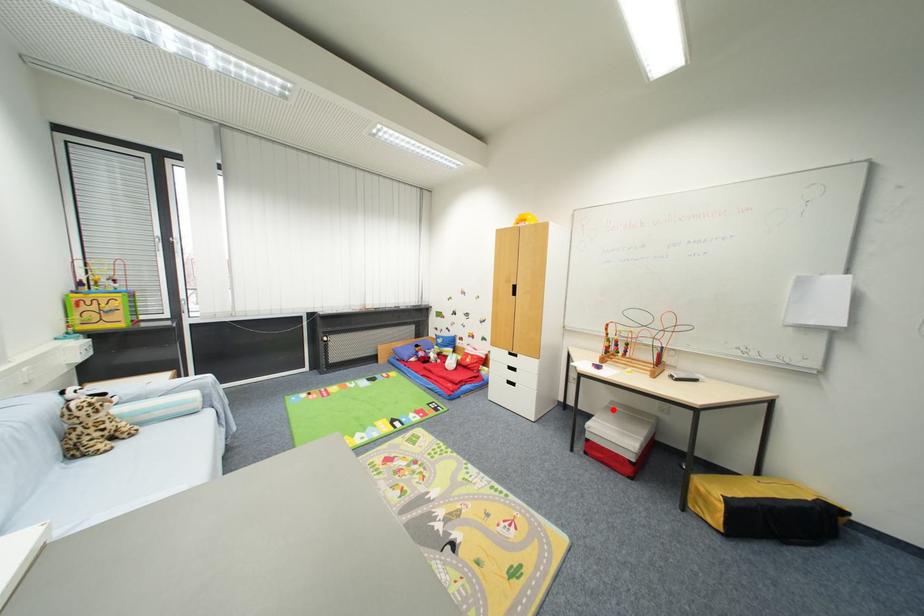
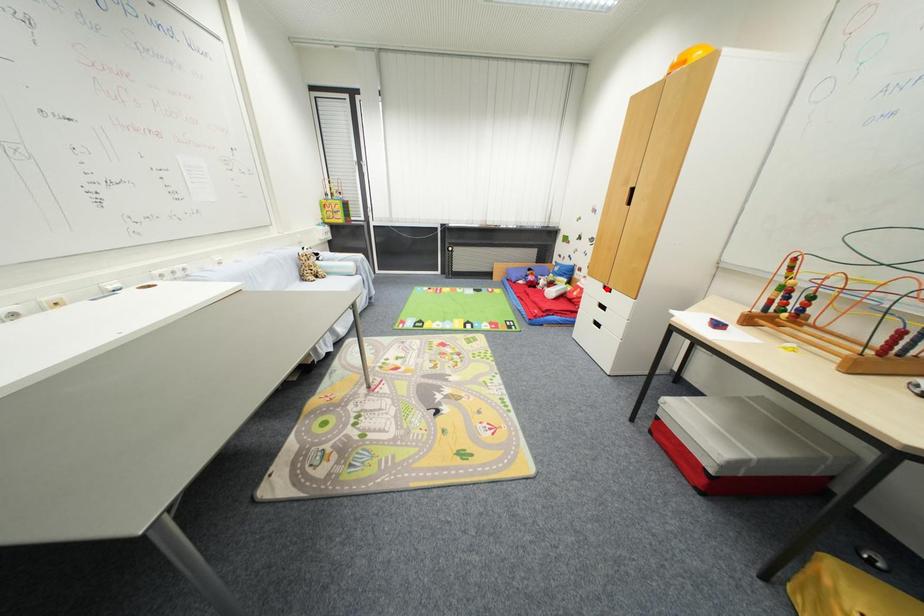
I am providing you with two images of the same scene from different viewpoints. A red point is marked on the first image and another point is marked on the second image. Is the marked point in image1 the same physical position as the marked point in image2?

No